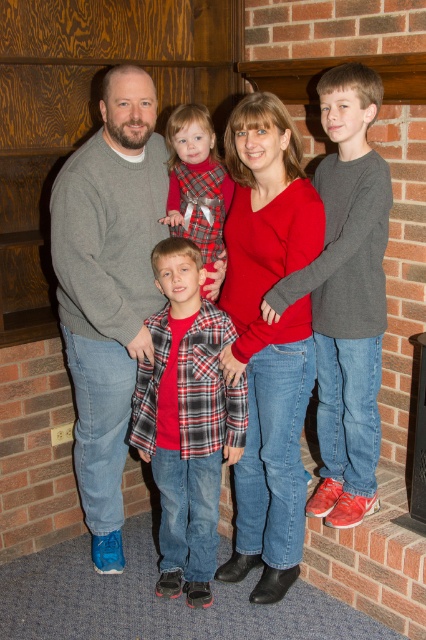
Question: Among these points, which one is nearest to the camera?

Choices:
 (A) (92, 516)
 (B) (299, 412)

Answer: (B)

Question: Among these objects, which one is nearest to the camera?

Choices:
 (A) plaid flannel shirt at center
 (B) matte gray sweater at left

Answer: (B)

Question: Can you confirm if matte red sweater at center is positioned to the left of plaid flannel shirt at center?

Choices:
 (A) yes
 (B) no

Answer: (B)

Question: Is matte red sweater at center thinner than plaid flannel shirt at center?

Choices:
 (A) yes
 (B) no

Answer: (A)

Question: Which point is farther from the camera taking this photo?

Choices:
 (A) click(x=210, y=164)
 (B) click(x=276, y=362)

Answer: (A)

Question: Can you confirm if matte red sweater at center is thinner than plaid flannel shirt at center?

Choices:
 (A) yes
 (B) no

Answer: (A)